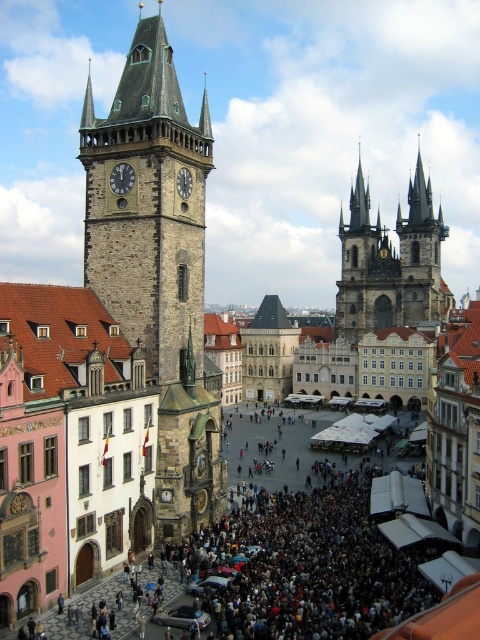
Question: Is golden stone spires at upper right to the right of matte stone clock tower at upper left from the viewer's perspective?

Choices:
 (A) yes
 (B) no

Answer: (A)

Question: Which point is farther from the camera taking this photo?

Choices:
 (A) (349, 195)
 (B) (180, 184)
 (C) (152, 205)
 (D) (131, 179)

Answer: (A)

Question: Among these objects, which one is farthest from the camera?

Choices:
 (A) matte stone clock tower at upper left
 (B) dark gray stone clock at center
 (C) golden stone spires at upper right

Answer: (C)

Question: Does golden stone spires at upper right appear on the left side of dark gray stone clock at center?

Choices:
 (A) no
 (B) yes

Answer: (A)

Question: Estimate the real-world distances between objects in this image. Which object is closer to the golden stone spires at upper right?

Choices:
 (A) stone clock tower at left
 (B) dark gray stone clock at center
 (C) matte stone clock tower at upper left

Answer: (A)

Question: Does golden stone spires at upper right appear on the left side of matte stone clock tower at upper left?

Choices:
 (A) no
 (B) yes

Answer: (A)